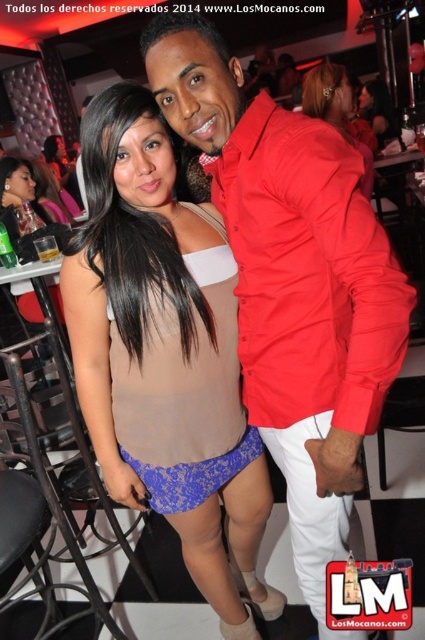
You are a photographer trying to capture the perfect shot of the matte red shirt at center. The camera is positioned at point (292,282). To avoid blurring the subject, you need to ensure the camera is at least 0.5 meters away from the subject. Is the camera positioned at a safe distance?

The camera is positioned exactly at the point where the matte red shirt at center is located, so the distance is zero. Therefore, the camera is not at a safe distance and will likely blur the subject.

You are standing at the entrance of the nightclub and want to take a photo of the point at coordinates point (197,394). Your camera has a maximum focus range of 4 feet. Will you be able to focus on the point?

The distance between you and point (197,394) is 4.29 feet, which exceeds the camera maximum focus range of 4 feet. Therefore, you won